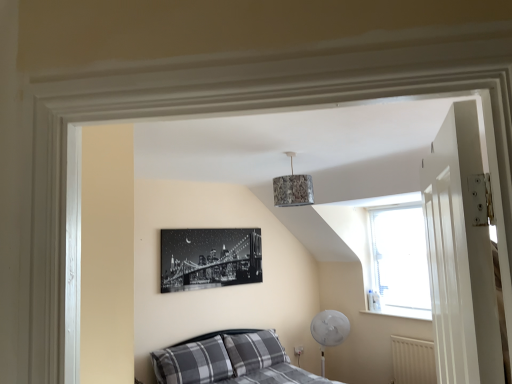
Where is `free point above transparent glass window at upper right (from a real-world perspective)`? Image resolution: width=512 pixels, height=384 pixels. free point above transparent glass window at upper right (from a real-world perspective) is located at coordinates (388, 205).